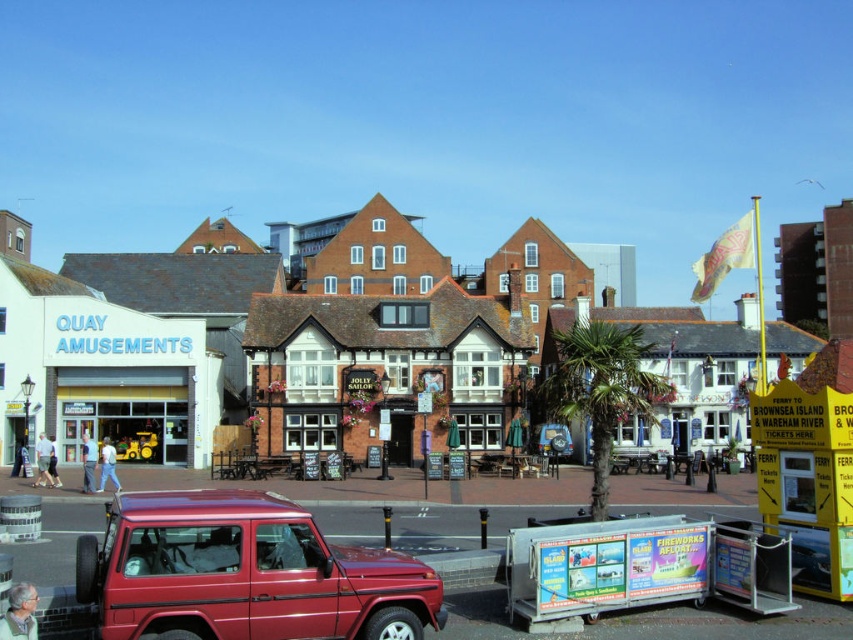
Who is shorter, white brick building at center or shiny red suv at lower left?

With less height is shiny red suv at lower left.

Can you confirm if white brick building at center is positioned to the right of shiny red suv at lower left?

In fact, white brick building at center is to the left of shiny red suv at lower left.

Find the location of a particular element. white brick building at center is located at coordinates (318, 358).